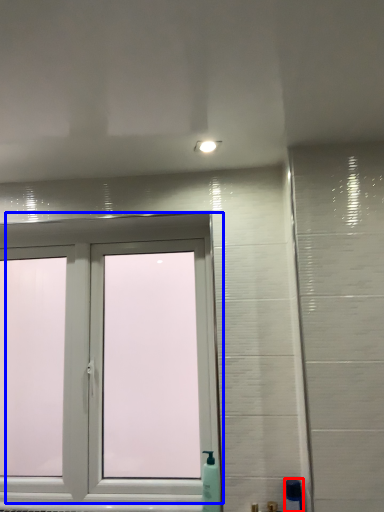
Question: Which object appears farthest to the camera in this image, soap dispenser (highlighted by a red box) or window (highlighted by a blue box)?

Choices:
 (A) soap dispenser
 (B) window

Answer: (B)